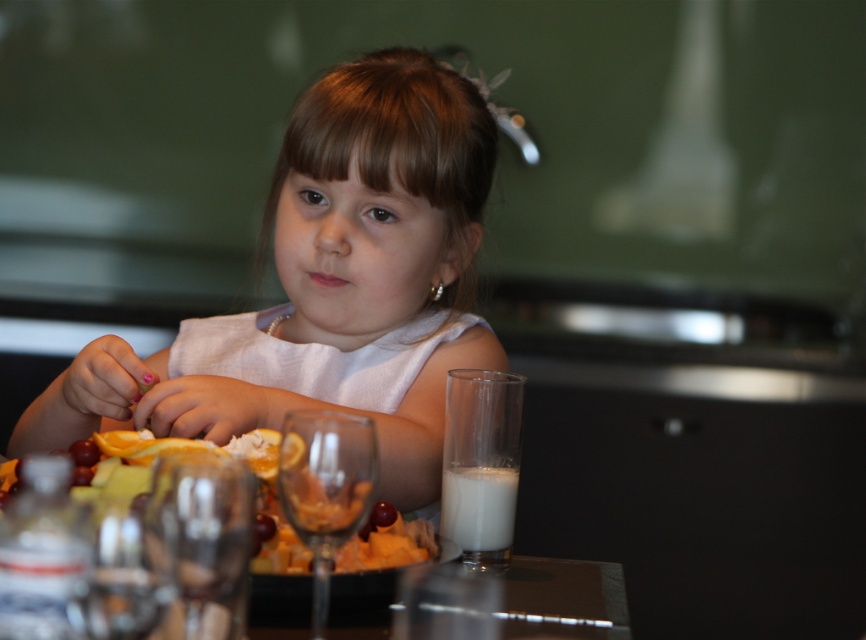
Question: In this image, where is glossy plastic fruit salad at lower left located relative to white opaque glass at lower right?

Choices:
 (A) below
 (B) above

Answer: (B)

Question: Does glossy plastic fruit salad at lower left have a lesser width compared to white opaque glass at lower right?

Choices:
 (A) yes
 (B) no

Answer: (B)

Question: Does white fabric child at center have a larger size compared to glossy plastic fruit salad at lower left?

Choices:
 (A) yes
 (B) no

Answer: (A)

Question: Which object is positioned closest to the white fabric child at center?

Choices:
 (A) white opaque glass at lower right
 (B) glossy plastic fruit salad at lower left

Answer: (B)

Question: Considering the real-world distances, which object is closest to the white opaque glass at lower right?

Choices:
 (A) white fabric child at center
 (B) glossy plastic fruit salad at lower left

Answer: (B)

Question: Which of the following is the farthest from the observer?

Choices:
 (A) [x=386, y=208]
 (B) [x=354, y=538]
 (C) [x=453, y=474]

Answer: (A)